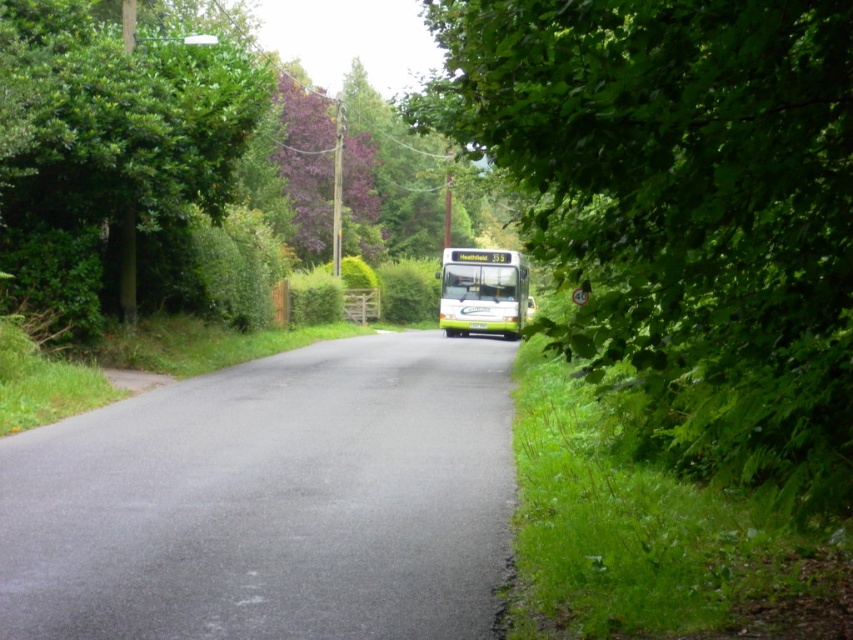
Question: Does green leafy tree at left come in front of green matte bus at center?

Choices:
 (A) no
 (B) yes

Answer: (B)

Question: Is green leafy tree at center bigger than green matte bus at center?

Choices:
 (A) yes
 (B) no

Answer: (A)

Question: Which point is closer to the camera?

Choices:
 (A) purple leafy tree at upper center
 (B) green leafy tree at left
 (C) green leafy tree at center
 (D) black asphalt road at center

Answer: (C)

Question: Which object appears farthest from the camera in this image?

Choices:
 (A) purple leafy tree at upper center
 (B) green leafy tree at left

Answer: (A)

Question: Is green leafy tree at left below purple leafy tree at upper center?

Choices:
 (A) yes
 (B) no

Answer: (A)

Question: Which is farther from the green leafy tree at center?

Choices:
 (A) green matte bus at center
 (B) purple leafy tree at upper center

Answer: (B)